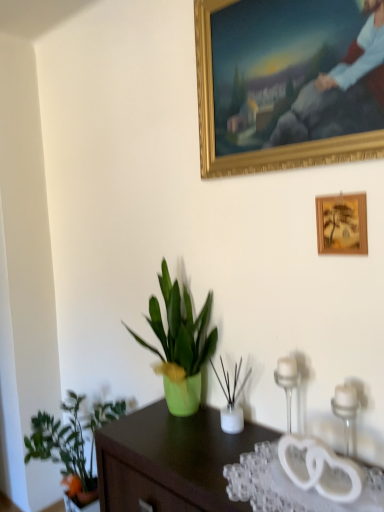
The image size is (384, 512). What do you see at coordinates (290, 486) in the screenshot?
I see `transparent plastic glass table at lower right` at bounding box center [290, 486].

The width and height of the screenshot is (384, 512). Describe the element at coordinates (232, 400) in the screenshot. I see `green matte vase at center, arranged as the 2th houseplant when viewed from the top` at that location.

You are a GUI agent. You are given a task and a screenshot of the screen. Output one action in this format:
    pyautogui.click(x=<x>, y=<y>)
    Task: Click on the wooden picture frame at lower right, which is counted as the 2th picture frame, starting from the top
    The width and height of the screenshot is (384, 512).
    Given the screenshot: What is the action you would take?
    pyautogui.click(x=342, y=224)

Where is `green matte plant at lower left, acting as the first houseplant starting from the bottom`? Image resolution: width=384 pixels, height=512 pixels. green matte plant at lower left, acting as the first houseplant starting from the bottom is located at coordinates (72, 444).

Could you tell me if transparent plastic glass table at lower right is turned towards white glass candle holder at right, which is the first candle holder from front to back?

No, transparent plastic glass table at lower right is not aimed at white glass candle holder at right, which is the first candle holder from front to back.

From the picture: From the image's perspective, which one is positioned higher, transparent plastic glass table at lower right or white glass candle holder at right, placed as the 1th candle holder when sorted from right to left?

white glass candle holder at right, placed as the 1th candle holder when sorted from right to left, is shown above in the image.

From a real-world perspective, who is located lower, transparent plastic glass table at lower right or white glass candle holder at right, the second candle holder from the back?

From a 3D spatial view, transparent plastic glass table at lower right is below.

Which is less distant, [332,510] or [348,433]?

Clearly, point [332,510] is closer to the camera than point [348,433].

Does point (39, 419) lie in front of point (182, 397)?

No, (39, 419) is further to viewer.

Based on the photo, considering the positions of objects green matte plant at lower left, acting as the first houseplant starting from the bottom, and green matte plant at center, marked as the first houseplant in a top-to-bottom arrangement, in the image provided, who is more to the left, green matte plant at lower left, acting as the first houseplant starting from the bottom, or green matte plant at center, marked as the first houseplant in a top-to-bottom arrangement,?

green matte plant at lower left, acting as the first houseplant starting from the bottom.

Considering the relative sizes of green matte plant at lower left, acting as the first houseplant starting from the bottom, and green matte plant at center, which is the 3th houseplant in bottom-to-top order, in the image provided, is green matte plant at lower left, acting as the first houseplant starting from the bottom, taller than green matte plant at center, which is the 3th houseplant in bottom-to-top order,?

Yes, green matte plant at lower left, acting as the first houseplant starting from the bottom, is taller than green matte plant at center, which is the 3th houseplant in bottom-to-top order.

From a real-world perspective, does green matte plant at lower left, acting as the first houseplant starting from the bottom, sit lower than green matte plant at center, marked as the first houseplant in a top-to-bottom arrangement?

Yes, from a real-world perspective, green matte plant at lower left, acting as the first houseplant starting from the bottom, is below green matte plant at center, marked as the first houseplant in a top-to-bottom arrangement.

Which is correct: white glass candle holder at right, placed as the second candle holder when sorted from left to right, is inside clear glass candle holder at right, the second candle holder viewed from the front, or outside of it?

white glass candle holder at right, placed as the second candle holder when sorted from left to right, is not enclosed by clear glass candle holder at right, the second candle holder viewed from the front.

Is white glass candle holder at right, which is the first candle holder from front to back, oriented towards clear glass candle holder at right, the 1th candle holder in the left-to-right sequence?

No, white glass candle holder at right, which is the first candle holder from front to back, does not turn towards clear glass candle holder at right, the 1th candle holder in the left-to-right sequence.

Which is closer to the camera, [345,435] or [288,372]?

The point [288,372] is in front.

How many degrees apart are the facing directions of white glass candle holder at right, placed as the second candle holder when sorted from left to right, and clear glass candle holder at right, marked as the 2th candle holder in a right-to-left arrangement?

The angular difference between white glass candle holder at right, placed as the second candle holder when sorted from left to right, and clear glass candle holder at right, marked as the 2th candle holder in a right-to-left arrangement, is 0.000392 degrees.

From the image's perspective, who appears lower, green matte plant at lower left, which is the 3th houseplant in top-to-bottom order, or wooden picture frame at lower right, placed as the first picture frame when sorted from bottom to top?

green matte plant at lower left, which is the 3th houseplant in top-to-bottom order.

In the image, is green matte plant at lower left, acting as the first houseplant starting from the bottom, on the left side or the right side of wooden picture frame at lower right, placed as the first picture frame when sorted from bottom to top?

From the image, it's evident that green matte plant at lower left, acting as the first houseplant starting from the bottom, is to the left of wooden picture frame at lower right, placed as the first picture frame when sorted from bottom to top.

Considering the relative positions of green matte plant at lower left, which is the 3th houseplant in top-to-bottom order, and wooden picture frame at lower right, placed as the first picture frame when sorted from bottom to top, in the image provided, is green matte plant at lower left, which is the 3th houseplant in top-to-bottom order, in front of wooden picture frame at lower right, placed as the first picture frame when sorted from bottom to top,?

No.

Locate an element on the screen. This screenshot has width=384, height=512. the 3rd houseplant located beneath the wooden picture frame at lower right, placed as the first picture frame when sorted from bottom to top (from a real-world perspective) is located at coordinates (72, 444).

Does green matte plant at center, which appears as the 2th houseplant when viewed from the left, have a lesser width compared to green matte vase at center, placed as the first houseplant when sorted from right to left?

Incorrect, the width of green matte plant at center, which appears as the 2th houseplant when viewed from the left, is not less than that of green matte vase at center, placed as the first houseplant when sorted from right to left.

Consider the image. How distant is green matte plant at center, marked as the first houseplant in a top-to-bottom arrangement, from green matte vase at center, placed as the first houseplant when sorted from right to left?

green matte plant at center, marked as the first houseplant in a top-to-bottom arrangement, is 7.44 inches from green matte vase at center, placed as the first houseplant when sorted from right to left.

This screenshot has height=512, width=384. I want to click on the 1st houseplant behind the green matte vase at center, placed as the first houseplant when sorted from right to left, so click(180, 344).

Consider the image. Looking at the image, does green matte plant at center, marked as the 2th houseplant in a right-to-left arrangement, seem bigger or smaller compared to green matte vase at center, placed as the first houseplant when sorted from right to left?

Considering their sizes, green matte plant at center, marked as the 2th houseplant in a right-to-left arrangement, takes up more space than green matte vase at center, placed as the first houseplant when sorted from right to left.

From the image's perspective, does green matte vase at center, arranged as the 2th houseplant when viewed from the top, appear higher than transparent plastic glass table at lower right?

Indeed, from the image's perspective, green matte vase at center, arranged as the 2th houseplant when viewed from the top, is shown above transparent plastic glass table at lower right.

From the picture: Can you confirm if green matte vase at center, which appears as the 2th houseplant when ordered from the bottom, is smaller than transparent plastic glass table at lower right?

No.

Can you confirm if green matte vase at center, placed as the first houseplant when sorted from right to left, is shorter than transparent plastic glass table at lower right?

No.

Is green matte vase at center, placed as the first houseplant when sorted from right to left, aimed at transparent plastic glass table at lower right?

No.

From a real-world perspective, is clear glass candle holder at right, the second candle holder viewed from the front, physically above green matte plant at lower left, placed as the 1th houseplant when sorted from left to right?

Yes, from a real-world perspective, clear glass candle holder at right, the second candle holder viewed from the front, is over green matte plant at lower left, placed as the 1th houseplant when sorted from left to right

Does clear glass candle holder at right, the second candle holder viewed from the front, touch green matte plant at lower left, which is the 3th houseplant in top-to-bottom order?

clear glass candle holder at right, the second candle holder viewed from the front, is not next to green matte plant at lower left, which is the 3th houseplant in top-to-bottom order, and they're not touching.

Is point (291, 389) closer or farther from the camera than point (57, 448)?

Clearly, point (291, 389) is closer to the camera than point (57, 448).

Can you confirm if clear glass candle holder at right, the 1th candle holder in the left-to-right sequence, is smaller than green matte plant at lower left, the third houseplant viewed from the right?

Yes.

You are a GUI agent. You are given a task and a screenshot of the screen. Output one action in this format:
    pyautogui.click(x=<x>, y=<y>)
    Task: Click on the glass table that appears below the white glass candle holder at right, placed as the second candle holder when sorted from left to right (from the image's perspective)
    This screenshot has height=512, width=384.
    Given the screenshot: What is the action you would take?
    pyautogui.click(x=290, y=486)

Identify the location of houseplant on the left of green matte plant at center, which appears as the 2th houseplant when viewed from the left. (72, 444).

Looking at the image, which one is located further to transparent plastic glass table at lower right, clear glass candle holder at right, the 1th candle holder in the left-to-right sequence, or green matte plant at lower left, acting as the first houseplant starting from the bottom?

green matte plant at lower left, acting as the first houseplant starting from the bottom, lies further to transparent plastic glass table at lower right than the other object.

Considering their positions, is white glass candle holder at right, which is the first candle holder from front to back, positioned further to green matte plant at center, marked as the first houseplant in a top-to-bottom arrangement, than transparent plastic glass table at lower right?

white glass candle holder at right, which is the first candle holder from front to back, is positioned further to the anchor green matte plant at center, marked as the first houseplant in a top-to-bottom arrangement.

From the image, which object appears to be nearer to white glass candle holder at right, the second candle holder from the back, green matte plant at center, which appears as the 2th houseplant when viewed from the left, or transparent plastic glass table at lower right?

transparent plastic glass table at lower right.

Considering their positions, is green matte plant at center, which appears as the 2th houseplant when viewed from the left, positioned closer to transparent plastic glass table at lower right than gold-framed painting at upper center, the 1th picture frame when ordered from top to bottom?

Among the two, green matte plant at center, which appears as the 2th houseplant when viewed from the left, is located nearer to transparent plastic glass table at lower right.

When comparing their distances from green matte plant at center, which is the 3th houseplant in bottom-to-top order, does wooden picture frame at lower right, placed as the first picture frame when sorted from bottom to top, or gold-framed painting at upper center, which ranks as the second picture frame in bottom-to-top order, seem further?

Based on the image, gold-framed painting at upper center, which ranks as the second picture frame in bottom-to-top order, appears to be further to green matte plant at center, which is the 3th houseplant in bottom-to-top order.

From the image, which object appears to be nearer to clear glass candle holder at right, the 1th candle holder in the left-to-right sequence, green matte vase at center, which ranks as the third houseplant in left-to-right order, or transparent plastic glass table at lower right?

Among the two, green matte vase at center, which ranks as the third houseplant in left-to-right order, is located nearer to clear glass candle holder at right, the 1th candle holder in the left-to-right sequence.

Looking at the image, which one is located further to transparent plastic glass table at lower right, white glass candle holder at right, placed as the 1th candle holder when sorted from right to left, or clear glass candle holder at right, positioned as the first candle holder in back-to-front order?

Among the two, clear glass candle holder at right, positioned as the first candle holder in back-to-front order, is located further to transparent plastic glass table at lower right.

Looking at the image, which one is located further to green matte vase at center, placed as the first houseplant when sorted from right to left, green matte plant at lower left, acting as the first houseplant starting from the bottom, or wooden picture frame at lower right, which is counted as the 2th picture frame, starting from the top?

The object further to green matte vase at center, placed as the first houseplant when sorted from right to left, is green matte plant at lower left, acting as the first houseplant starting from the bottom.

Where is `houseplant between transparent plastic glass table at lower right and green matte plant at center, which is the 3th houseplant in bottom-to-top order, from front to back`? The width and height of the screenshot is (384, 512). houseplant between transparent plastic glass table at lower right and green matte plant at center, which is the 3th houseplant in bottom-to-top order, from front to back is located at coordinates (232, 400).

The image size is (384, 512). I want to click on glass table that lies between wooden picture frame at lower right, which is counted as the 2th picture frame, starting from the top, and green matte plant at lower left, placed as the 1th houseplant when sorted from left to right, from top to bottom, so click(x=290, y=486).

You are a GUI agent. You are given a task and a screenshot of the screen. Output one action in this format:
    pyautogui.click(x=<x>, y=<y>)
    Task: Click on the candle holder between green matte plant at lower left, which is the 3th houseplant in top-to-bottom order, and transparent plastic glass table at lower right from left to right
    The width and height of the screenshot is (384, 512).
    Given the screenshot: What is the action you would take?
    click(x=287, y=381)

Identify the location of houseplant between gold-framed painting at upper center, which ranks as the second picture frame in bottom-to-top order, and green matte vase at center, which ranks as the third houseplant in left-to-right order, from top to bottom. The image size is (384, 512). (x=180, y=344).